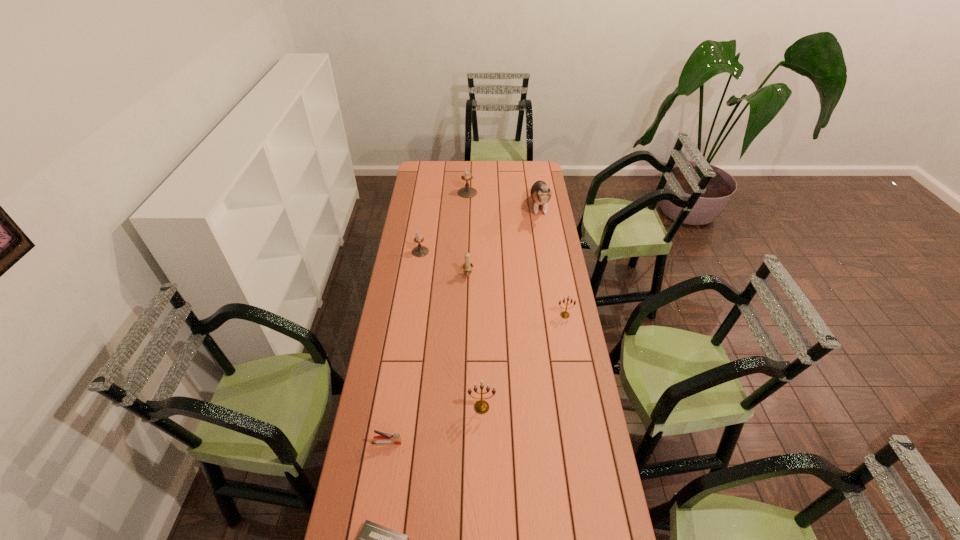
Identify the location of free region that satisfies the following two spatial constraints: 1. on the handle side of the fourth farthest object; 2. on the handle side of the seventh farthest object. The height and width of the screenshot is (540, 960). (463, 442).